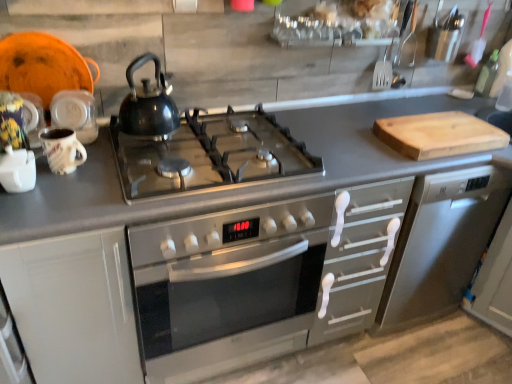
Locate an element on the screen. This screenshot has height=384, width=512. vacant region in front of green glass bottle at upper right is located at coordinates click(x=476, y=112).